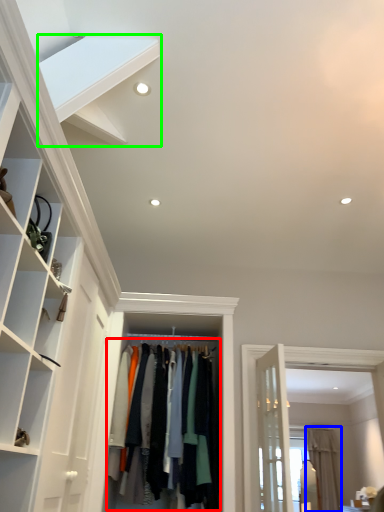
Question: Estimate the real-world distances between objects in this image. Which object is closer to clothing (highlighted by a red box), curtain (highlighted by a blue box) or stairs (highlighted by a green box)?

Choices:
 (A) curtain
 (B) stairs

Answer: (B)